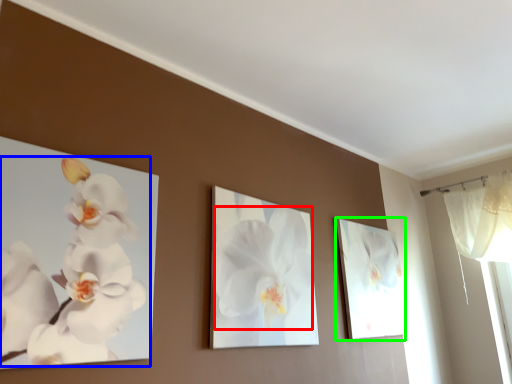
Question: Based on their relative distances, which object is farther from flower (highlighted by a red box)? Choose from flower (highlighted by a blue box) and picture frame (highlighted by a green box).

Choices:
 (A) flower
 (B) picture frame

Answer: (B)